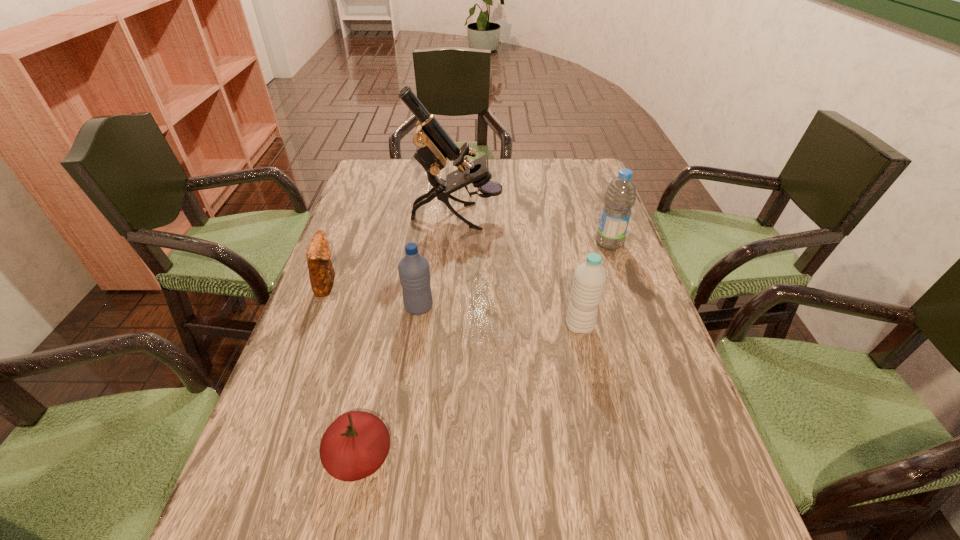
In the image, there is a desktop. Identify the location of vacant region at the right edge. (564, 214).

What are the coordinates of `vacant space at the far left corner` in the screenshot? It's located at (391, 160).

Find the location of a particular element. This screenshot has width=960, height=540. free space at the far right corner of the desktop is located at coordinates (579, 176).

Locate an element on the screen. free spot between the tomato and the farthest water bottle is located at coordinates (485, 350).

At what (x,y) coordinates should I click in order to perform the action: click on free space between the rightmost object and the clutch bag. Please return your answer as a coordinate pair (x, y). Looking at the image, I should click on (468, 264).

Where is `vacant area that lies between the tomato and the second object from right to left`? Image resolution: width=960 pixels, height=540 pixels. vacant area that lies between the tomato and the second object from right to left is located at coordinates (469, 392).

Where is `vacant space that's between the second water bottle from left to right and the second shortest object`? This screenshot has width=960, height=540. vacant space that's between the second water bottle from left to right and the second shortest object is located at coordinates (453, 305).

Locate an element on the screen. Image resolution: width=960 pixels, height=540 pixels. empty space between the leftmost water bottle and the second shortest object is located at coordinates (373, 295).

Find the location of `free spot between the fifth tallest object and the fifth object from left to right`. free spot between the fifth tallest object and the fifth object from left to right is located at coordinates (453, 305).

Image resolution: width=960 pixels, height=540 pixels. What are the coordinates of `free space between the clutch bag and the microscope` in the screenshot? It's located at (392, 250).